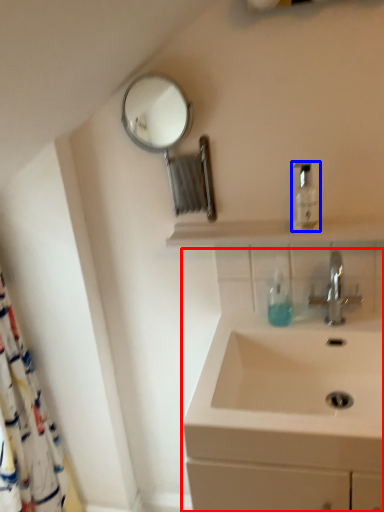
Question: Among these objects, which one is nearest to the camera, sink (highlighted by a red box) or mouthwash (highlighted by a blue box)?

Choices:
 (A) sink
 (B) mouthwash

Answer: (A)